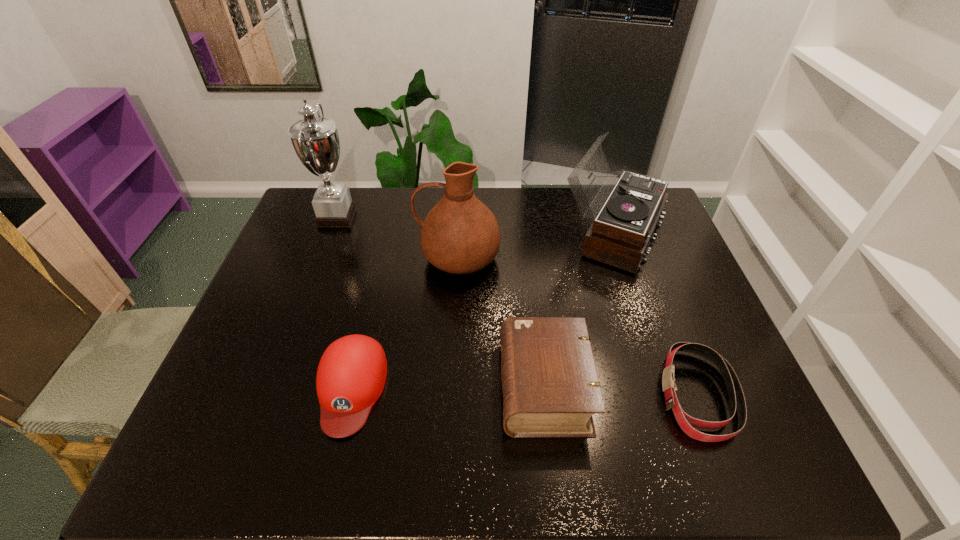
What are the coordinates of `vacant space located 0.260m on the side of the pitcher with the handle` in the screenshot? It's located at (333, 258).

Identify the location of free space located 0.140m on the front of the record player. (639, 312).

You are a GUI agent. You are given a task and a screenshot of the screen. Output one action in this format:
    pyautogui.click(x=<x>, y=<y>)
    Task: Click on the vacant space located on the spine side of the Bible
    The image size is (960, 540).
    Given the screenshot: What is the action you would take?
    pyautogui.click(x=416, y=387)

The height and width of the screenshot is (540, 960). I want to click on vacant space situated 0.200m on the spine side of the Bible, so pos(416,387).

Find the location of a particular element. vacant space situated 0.210m on the spine side of the Bible is located at coordinates (412, 387).

This screenshot has width=960, height=540. What are the coordinates of `vacant region located 0.290m on the back of the dog collar` in the screenshot? It's located at (650, 272).

You are a GUI agent. You are given a task and a screenshot of the screen. Output one action in this format:
    pyautogui.click(x=<x>, y=<y>)
    Task: Click on the trophy cup present at the far edge
    This screenshot has width=960, height=540.
    Given the screenshot: What is the action you would take?
    pyautogui.click(x=315, y=140)

Locate an element on the screen. The image size is (960, 540). record player present at the far edge is located at coordinates (619, 236).

Find the location of a particular element. Bible situated at the near edge is located at coordinates (550, 384).

This screenshot has height=540, width=960. I want to click on baseball cap that is at the near edge, so click(x=351, y=375).